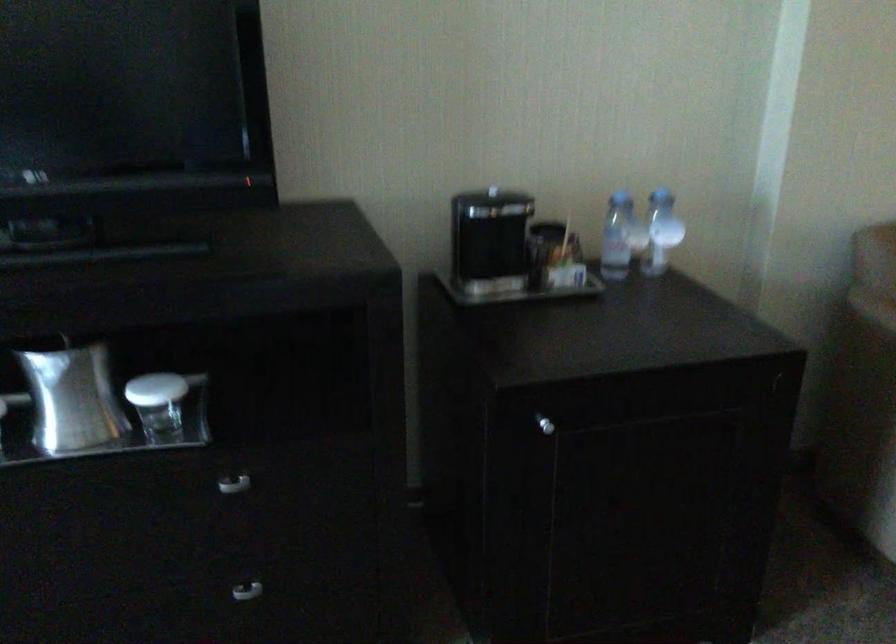
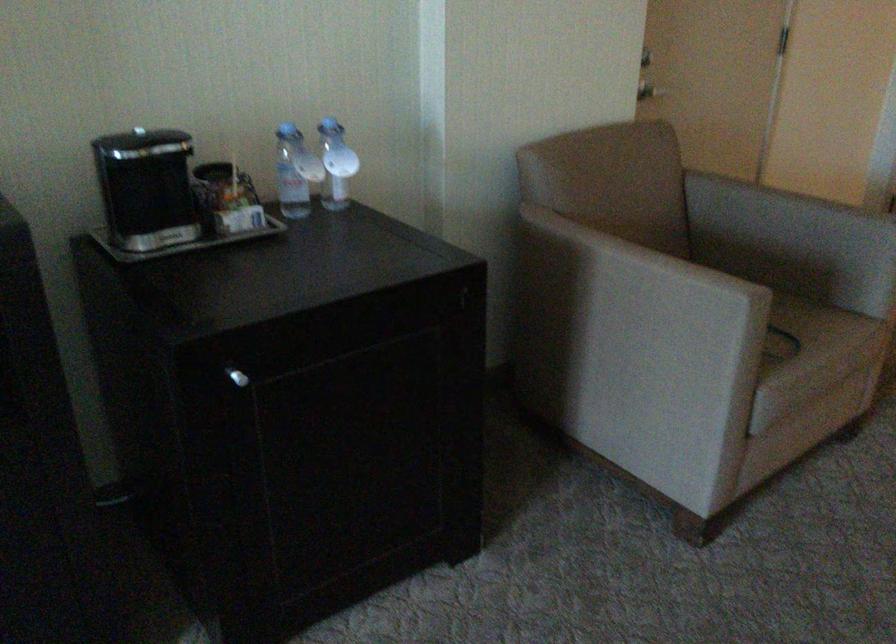
Where in the second image is the point corresponding to point (538, 422) from the first image?

(237, 377)